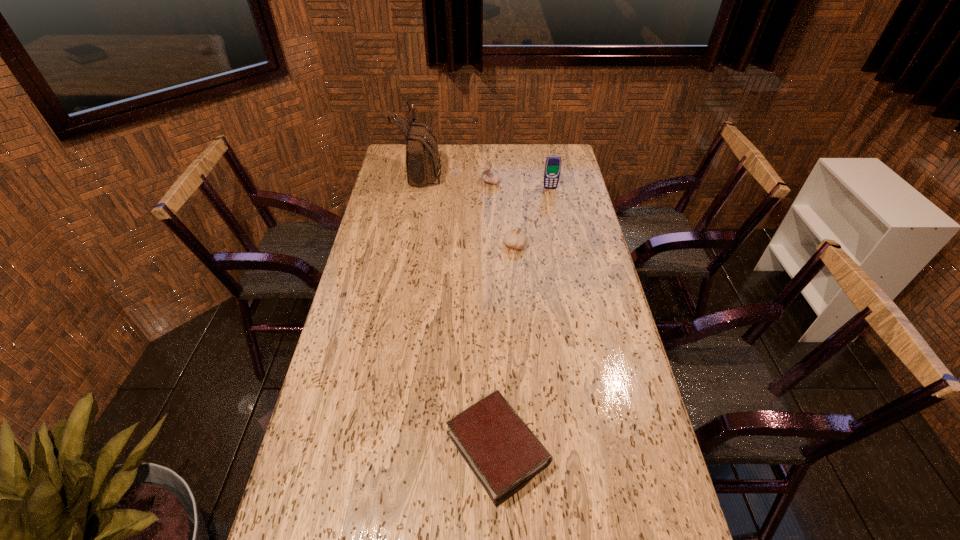
The image size is (960, 540). Identify the location of free spot at the left edge of the desktop. (362, 282).

The height and width of the screenshot is (540, 960). In order to click on free spot at the right edge of the desktop in this screenshot , I will do `click(545, 201)`.

Image resolution: width=960 pixels, height=540 pixels. What are the coordinates of `vacant space that is in between the shortest object and the cellular telephone` in the screenshot? It's located at (524, 319).

The height and width of the screenshot is (540, 960). What are the coordinates of `free space between the nearer garlic and the shoulder bag` in the screenshot? It's located at (468, 209).

In order to click on free space between the nearer garlic and the shortest object in this screenshot , I will do `click(506, 347)`.

The width and height of the screenshot is (960, 540). I want to click on unoccupied area between the shortest object and the farther garlic, so click(494, 315).

Identify the location of free space between the Bible and the leftmost object. Image resolution: width=960 pixels, height=540 pixels. (460, 310).

Find the location of a particular element. The height and width of the screenshot is (540, 960). blank region between the Bible and the taller garlic is located at coordinates (494, 315).

What are the coordinates of `free space that is in between the cellular telephone and the taller garlic` in the screenshot? It's located at (520, 185).

Find the location of a particular element. The width and height of the screenshot is (960, 540). free spot between the second tallest object and the nearer garlic is located at coordinates (533, 217).